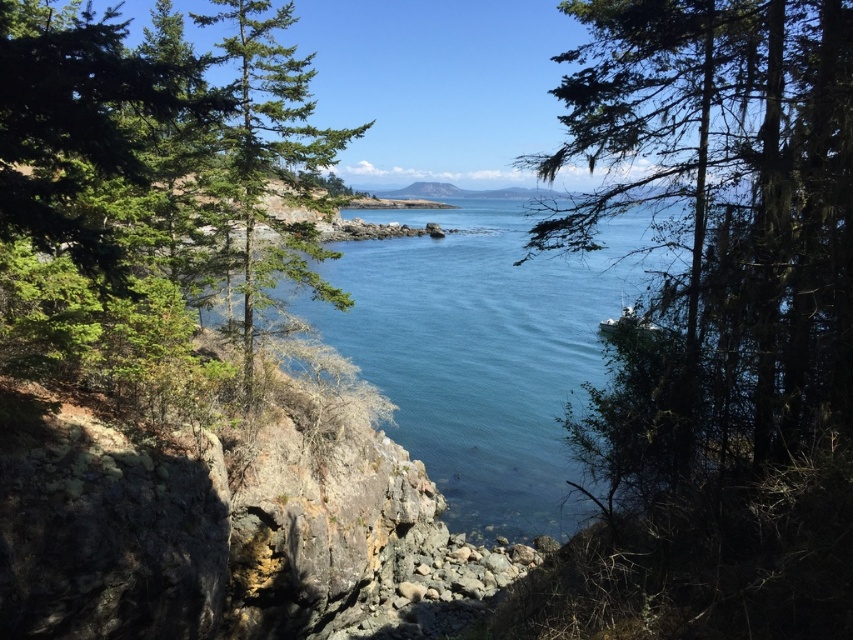
You are standing in the forest and want to reach the clear blue water at center. Based on the scene description, in which direction should you walk to reach it?

The clear blue water at center is located at the center of the image, so you should walk towards the center of the scene to reach it.